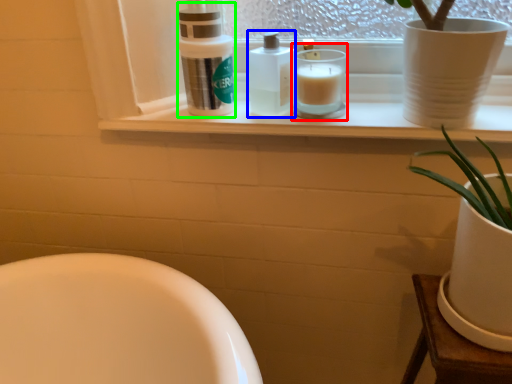
Question: Which is nearer to the candle holder (highlighted by a red box)? toiletry (highlighted by a blue box) or cleaning product (highlighted by a green box).

Choices:
 (A) toiletry
 (B) cleaning product

Answer: (A)